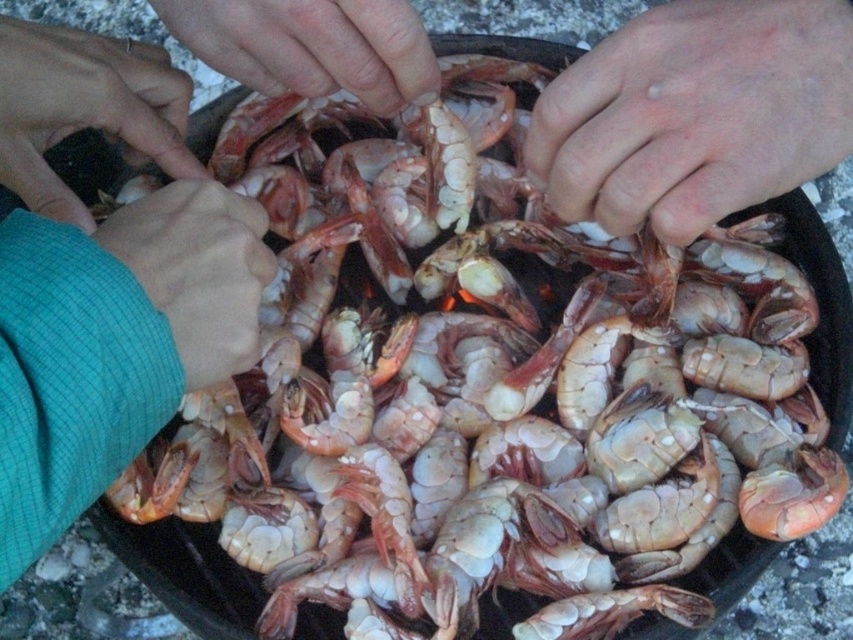
Does smooth skin hand at upper center have a lesser height compared to matte pink shrimp at left?

Yes, smooth skin hand at upper center is shorter than matte pink shrimp at left.

Does smooth skin hand at upper center have a greater height compared to matte pink shrimp at left?

No, smooth skin hand at upper center is not taller than matte pink shrimp at left.

Between point (206, 35) and point (399, 10), which one is positioned in front?

Point (399, 10) is in front.

Locate an element on the screen. The image size is (853, 640). smooth skin hand at upper center is located at coordinates click(311, 45).

Who is lower down, green fabric hand at lower left or green textured sleeve at lower left?

green textured sleeve at lower left

Between green fabric hand at lower left and green textured sleeve at lower left, which one has less height?

green textured sleeve at lower left is shorter.

Identify the location of green fabric hand at lower left. (84, 108).

Is dry skin at center positioned before matte pink shrimp at left?

Yes, dry skin at center is in front of matte pink shrimp at left.

Where is `dry skin at center`? This screenshot has height=640, width=853. dry skin at center is located at coordinates (695, 113).

Who is more forward, [767,45] or [363,60]?

Point [767,45]

At what (x,y) coordinates should I click in order to perform the action: click on dry skin at center. Please return your answer as a coordinate pair (x, y). The height and width of the screenshot is (640, 853). Looking at the image, I should click on (695, 113).